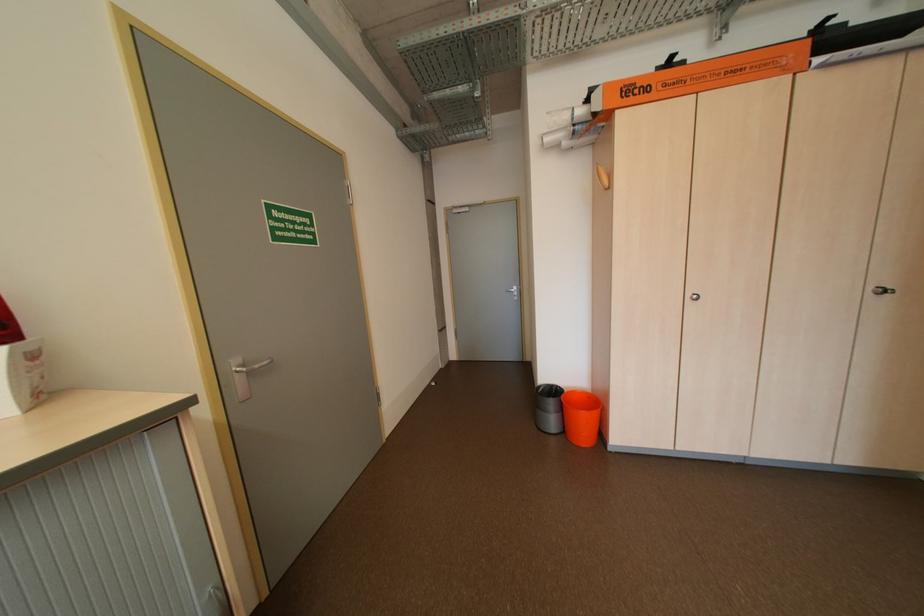
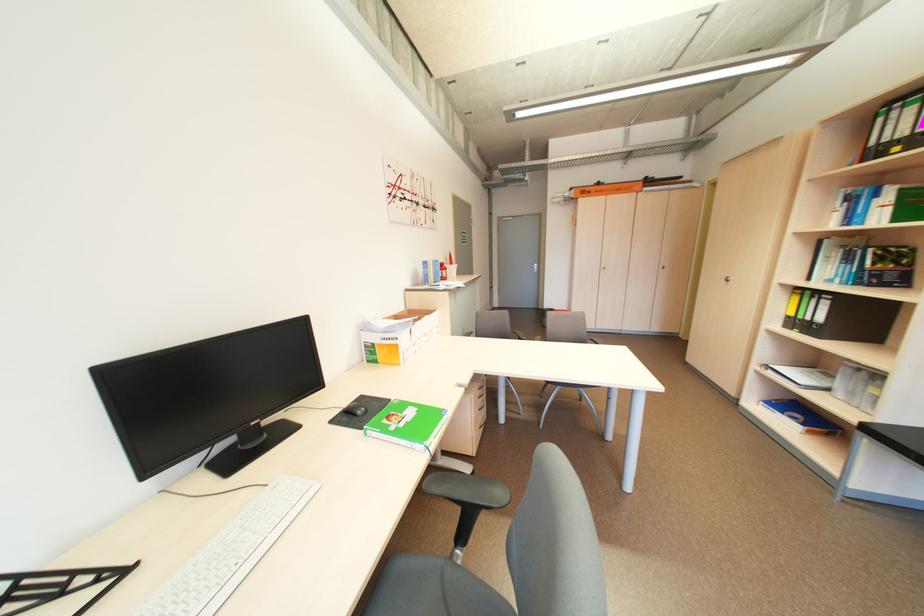
In the second image, find the point that corresponds to the point at 655,90 in the first image.

(599, 193)